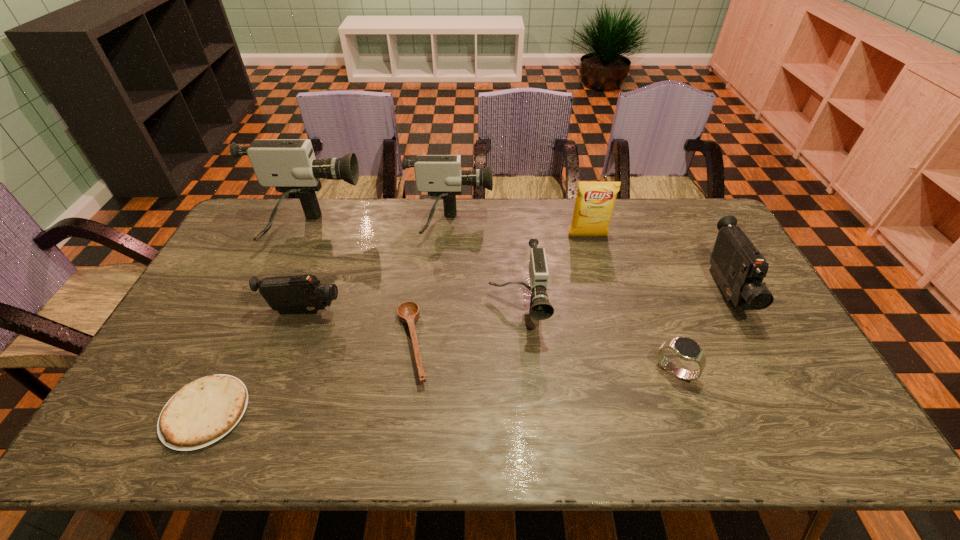
The height and width of the screenshot is (540, 960). I want to click on blank region between the tortilla and the seventh tallest object, so click(x=441, y=392).

The width and height of the screenshot is (960, 540). I want to click on empty space between the beige tortilla and the nearest white camcorder, so [x=361, y=361].

Identify the location of free space between the shortest object and the second biggest white camcorder. tap(327, 320).

Identify the location of free space that is in between the rightmost object and the blue watch. This screenshot has width=960, height=540. (700, 332).

Find the location of a particular element. free space between the seventh object from left to right and the rightmost object is located at coordinates [x=657, y=264].

Where is `free space between the sixth tallest object and the tallest object`? The height and width of the screenshot is (540, 960). free space between the sixth tallest object and the tallest object is located at coordinates (306, 272).

The height and width of the screenshot is (540, 960). In order to click on the closest object to the second shortest object in this screenshot , I will do `click(540, 309)`.

Locate which object ranks fourth in proximity to the biggest white camcorder. Please provide its 2D coordinates. Your answer should be formatted as a tuple, i.e. [(x, y)], where the tuple contains the x and y coordinates of a point satisfying the conditions above.

[(202, 412)]

Image resolution: width=960 pixels, height=540 pixels. I want to click on camcorder that is the fifth closest to the watch, so pos(289,165).

Identify which camcorder is the second nearest to the second biggest white camcorder. Please provide its 2D coordinates. Your answer should be formatted as a tuple, i.e. [(x, y)], where the tuple contains the x and y coordinates of a point satisfying the conditions above.

[(540, 309)]